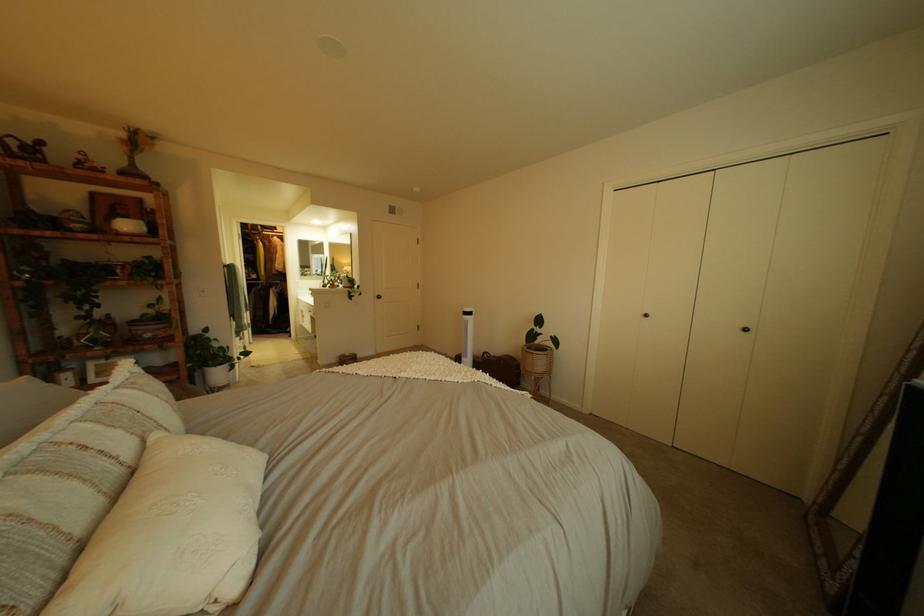
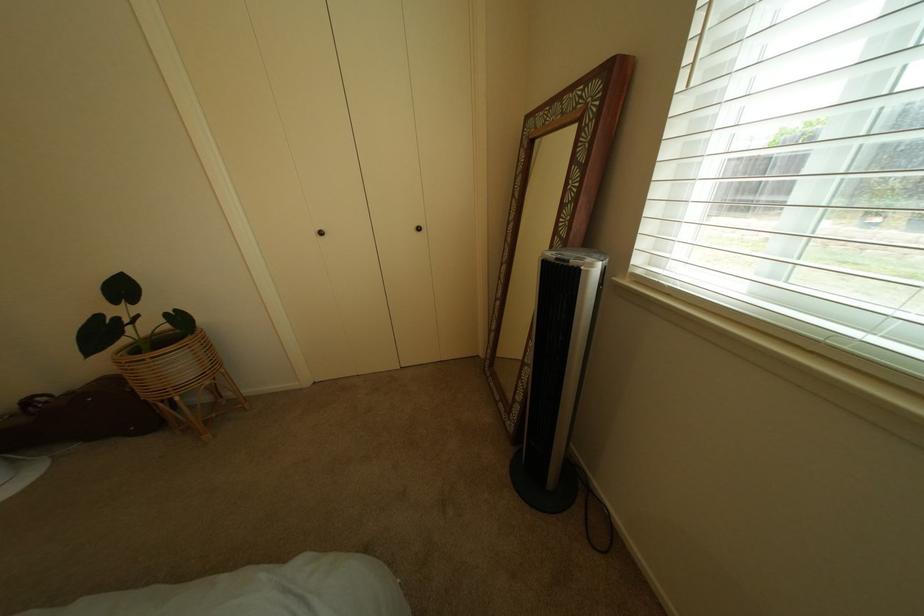
Where in the second image is the point corresponding to the point at 848,588 from the first image?

(527, 428)